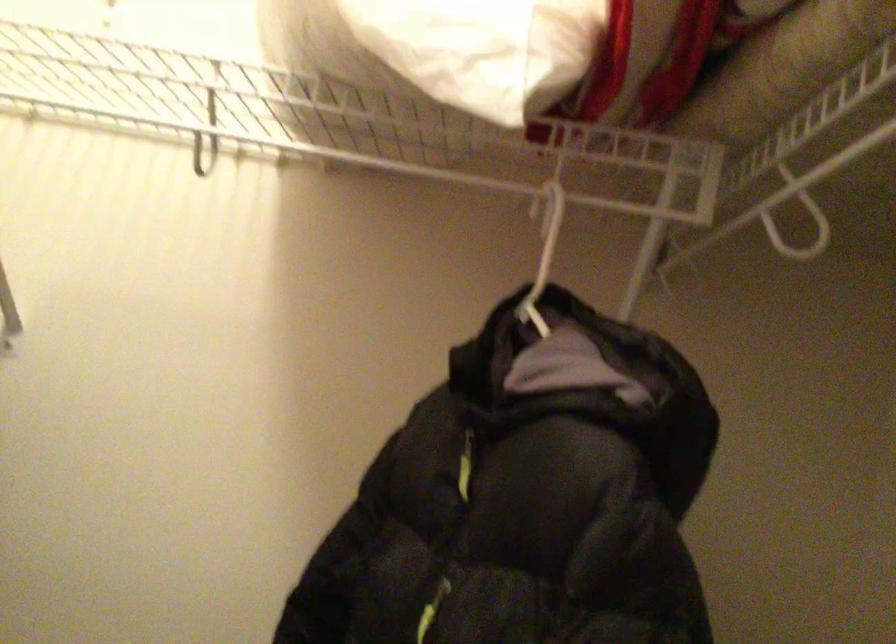
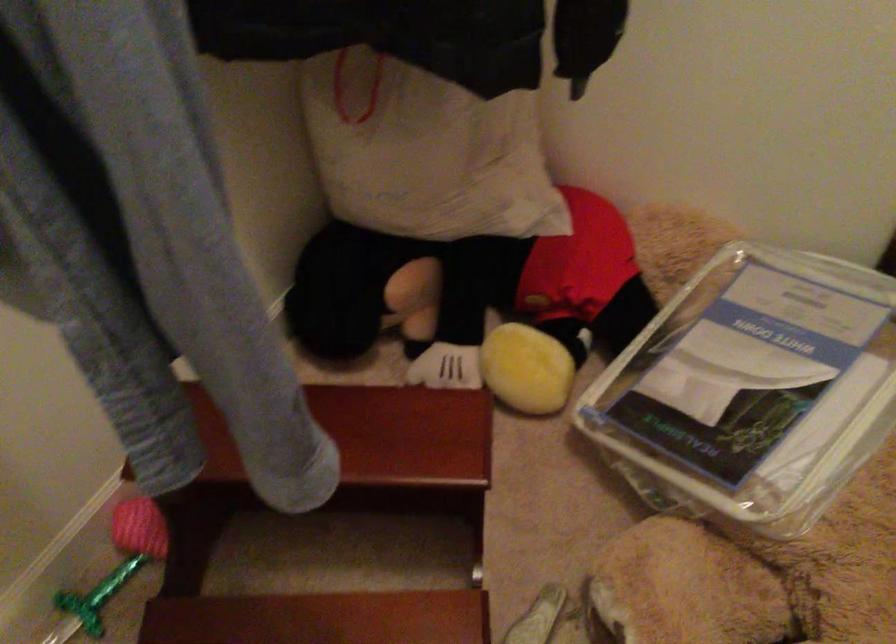
From the picture: First-person continuous shooting, in which direction is the camera rotating?

The rotation direction of the camera is right-down.